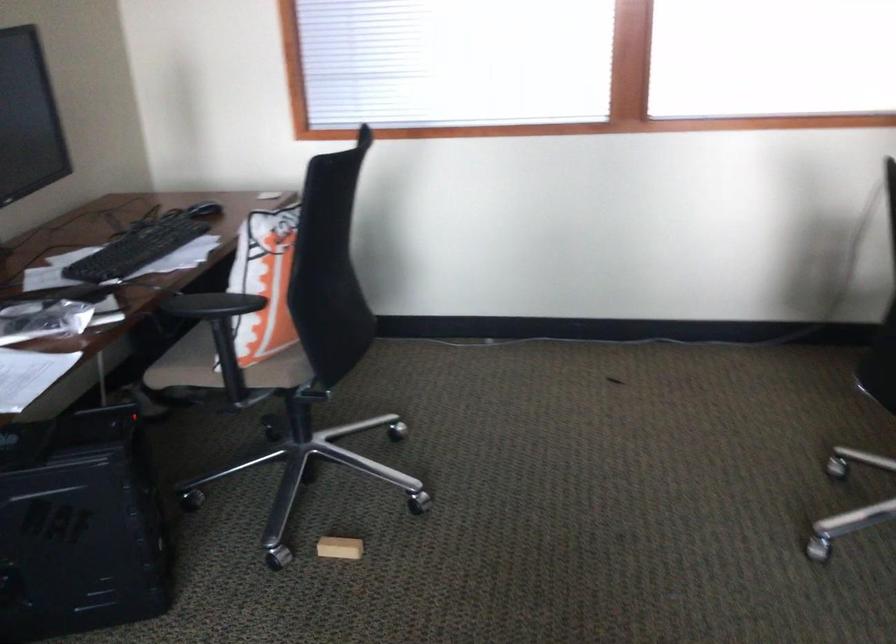
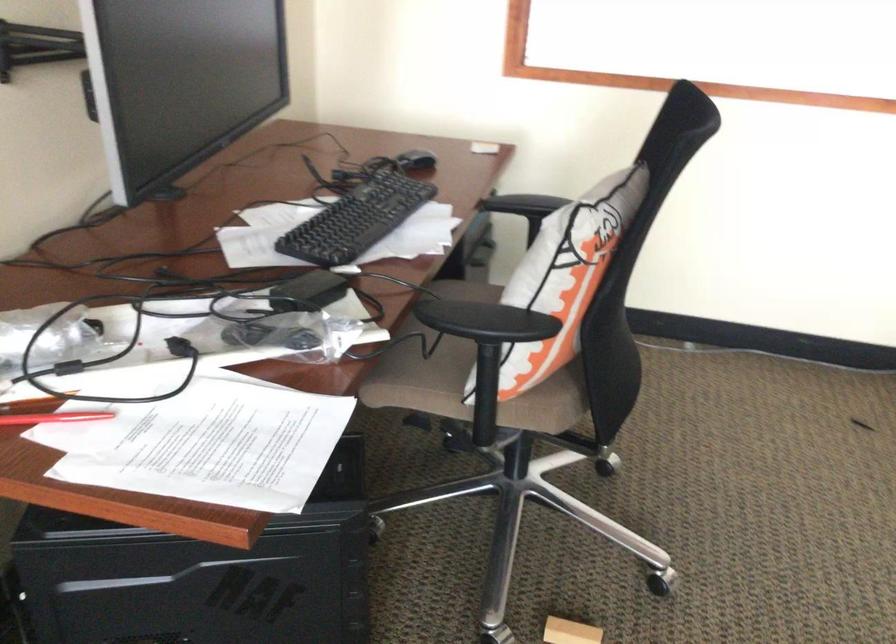
The point at (261, 263) is marked in the first image. Where is the corresponding point in the second image?

(564, 277)